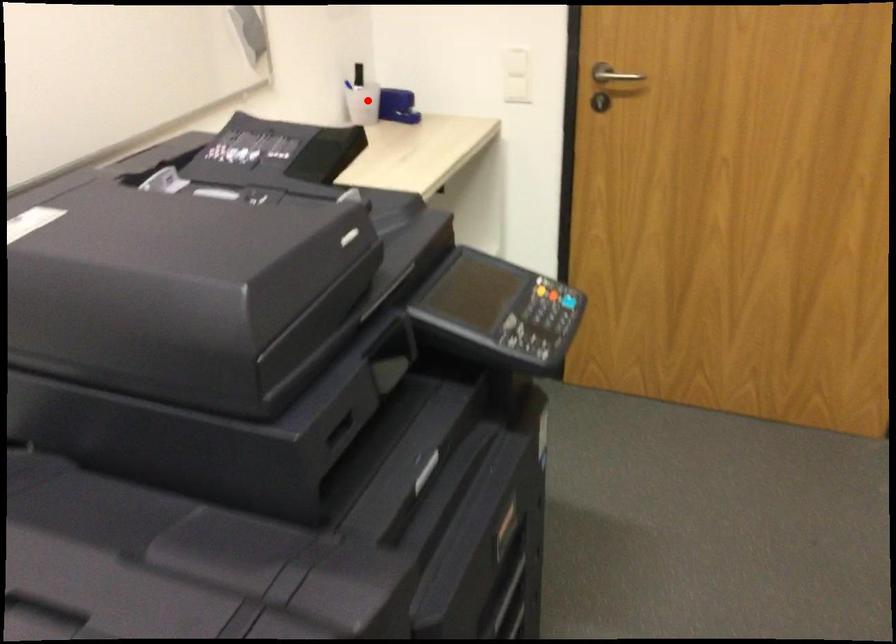
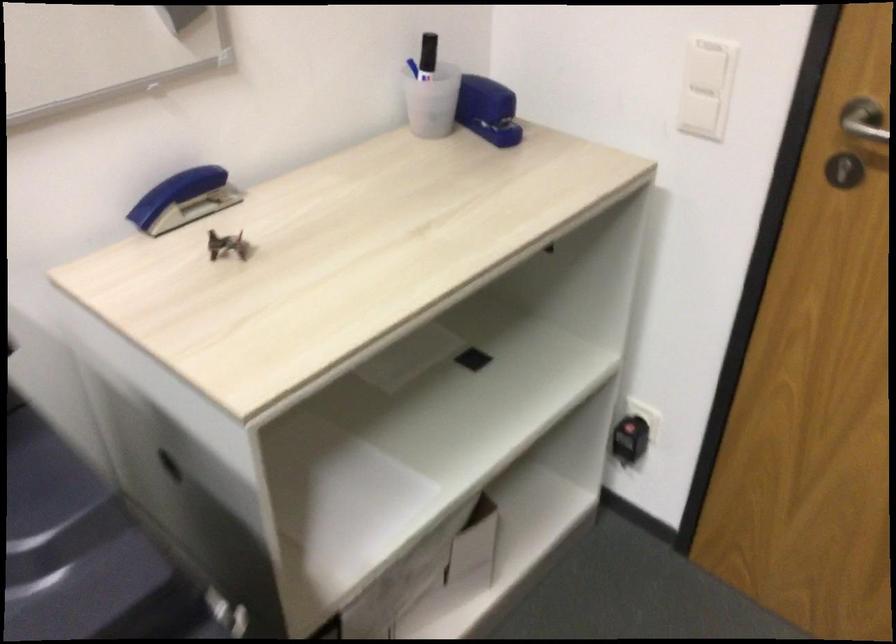
Question: I am providing you with two images of the same scene from different viewpoints. A red point is marked on the first image. Can you still see the location of the red point in image 2?

Choices:
 (A) Yes
 (B) No

Answer: (A)